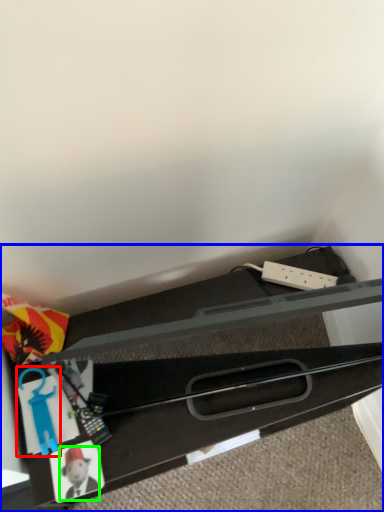
Question: Estimate the real-world distances between objects in this image. Which object is farther from toy (highlighted by a red box), furniture (highlighted by a blue box) or toy (highlighted by a green box)?

Choices:
 (A) furniture
 (B) toy

Answer: (A)